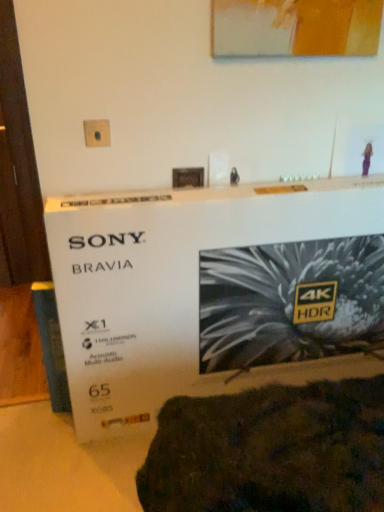
Question: Would you say white cardboard box at center is outside matte acrylic picture frame at upper center?

Choices:
 (A) yes
 (B) no

Answer: (A)

Question: Considering the relative sizes of white cardboard box at center and matte acrylic picture frame at upper center in the image provided, is white cardboard box at center wider than matte acrylic picture frame at upper center?

Choices:
 (A) no
 (B) yes

Answer: (B)

Question: Can you confirm if white cardboard box at center is shorter than matte acrylic picture frame at upper center?

Choices:
 (A) yes
 (B) no

Answer: (B)

Question: From a real-world perspective, is white cardboard box at center over matte acrylic picture frame at upper center?

Choices:
 (A) yes
 (B) no

Answer: (B)

Question: Considering the relative positions of white cardboard box at center and matte acrylic picture frame at upper center in the image provided, is white cardboard box at center to the right of matte acrylic picture frame at upper center from the viewer's perspective?

Choices:
 (A) yes
 (B) no

Answer: (B)

Question: Is white cardboard box at center in front of or behind matte plastic outlet at upper center in the image?

Choices:
 (A) front
 (B) behind

Answer: (A)

Question: Considering the positions of point (69, 347) and point (105, 126), is point (69, 347) closer or farther from the camera than point (105, 126)?

Choices:
 (A) farther
 (B) closer

Answer: (B)

Question: Considering the positions of white cardboard box at center and matte plastic outlet at upper center in the image, is white cardboard box at center taller or shorter than matte plastic outlet at upper center?

Choices:
 (A) tall
 (B) short

Answer: (A)

Question: Is white cardboard box at center to the left or to the right of matte plastic outlet at upper center in the image?

Choices:
 (A) left
 (B) right

Answer: (B)

Question: Looking at their shapes, would you say matte acrylic picture frame at upper center is wider or thinner than matte plastic outlet at upper center?

Choices:
 (A) wide
 (B) thin

Answer: (A)

Question: From a real-world perspective, is matte acrylic picture frame at upper center positioned above or below matte plastic outlet at upper center?

Choices:
 (A) below
 (B) above

Answer: (B)

Question: In terms of height, does matte acrylic picture frame at upper center look taller or shorter compared to matte plastic outlet at upper center?

Choices:
 (A) tall
 (B) short

Answer: (A)

Question: Is matte acrylic picture frame at upper center spatially inside matte plastic outlet at upper center, or outside of it?

Choices:
 (A) inside
 (B) outside

Answer: (B)

Question: Considering the positions of white cardboard box at center and matte acrylic picture frame at upper center in the image, is white cardboard box at center taller or shorter than matte acrylic picture frame at upper center?

Choices:
 (A) short
 (B) tall

Answer: (B)

Question: Is white cardboard box at center to the left or to the right of matte acrylic picture frame at upper center in the image?

Choices:
 (A) left
 (B) right

Answer: (A)